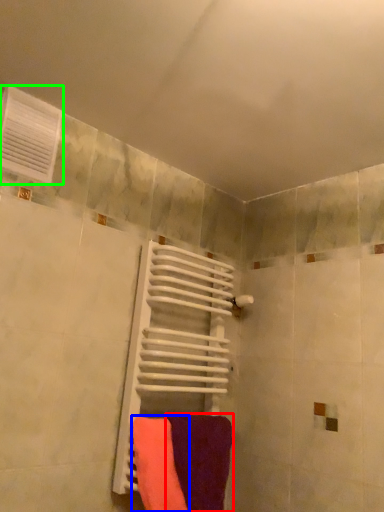
Question: Estimate the real-world distances between objects in this image. Which object is farther from towel (highlighted by a red box), towel (highlighted by a blue box) or air conditioning (highlighted by a green box)?

Choices:
 (A) towel
 (B) air conditioning

Answer: (B)